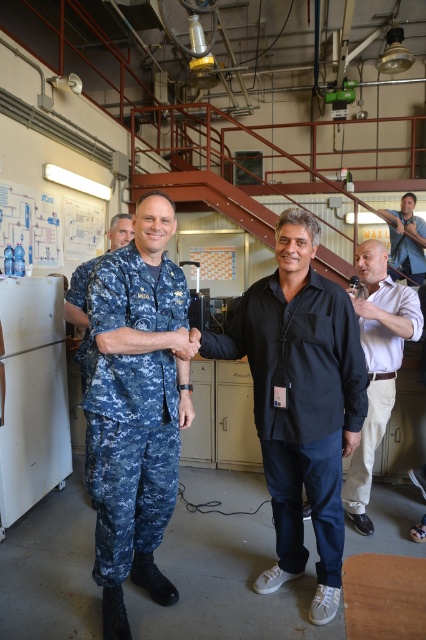
You are an observer in the workshop. You notice two people at center wearing the black cotton shirt at center and the digital camouflage uniform at center. Which clothing item is wider?

The black cotton shirt at center might be wider than the digital camouflage uniform at center.

You are standing in the workshop and need to determine which of the two points, point (138, 282) or point (367, 460), is nearer to you. Can you identify the closer one?

Point (138, 282) is closer to the camera than point (367, 460), so it is the nearer one.

You are an observer in the workshop. You notice two people at center wearing the black cotton shirt at center and the digital camouflage uniform at center. Which clothing item is shorter in length?

The black cotton shirt at center is shorter than the digital camouflage uniform at center.